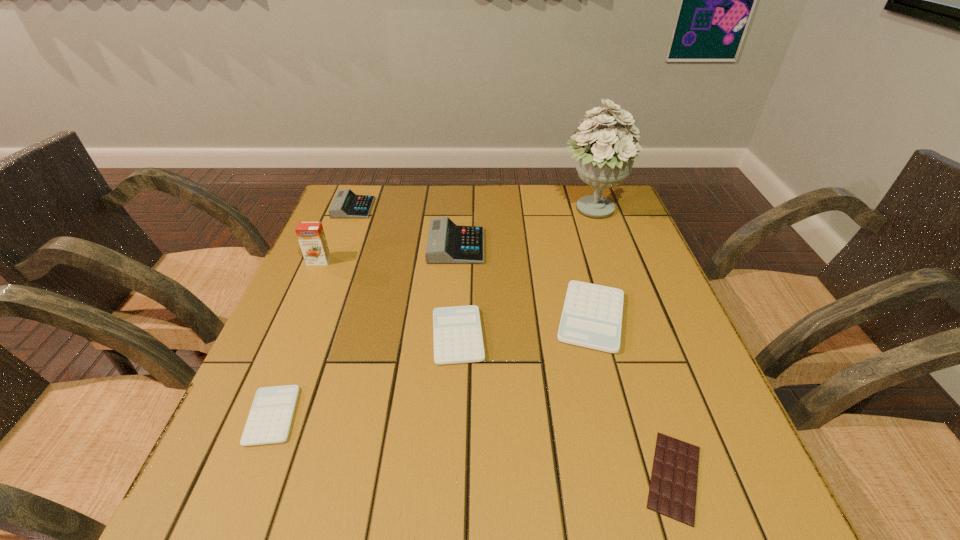
Find the location of a particular element. This screenshot has height=540, width=960. green bouquet is located at coordinates (604, 159).

I want to click on bouquet, so [x=604, y=159].

This screenshot has width=960, height=540. Identify the location of orange orange juice. (311, 236).

Where is `orange juice`? orange juice is located at coordinates (311, 236).

Identify the location of the tallest calculator. (448, 243).

Locate an element on the screen. Image resolution: width=960 pixels, height=540 pixels. the third tallest object is located at coordinates (448, 243).

Where is `the second tallest calculator`? the second tallest calculator is located at coordinates (346, 204).

At what (x,y) coordinates should I click in order to perform the action: click on the left gray calculator. Please return your answer as a coordinate pair (x, y). Looking at the image, I should click on 346,204.

Locate an element on the screen. Image resolution: width=960 pixels, height=540 pixels. the rightmost calculator is located at coordinates (592, 314).

The height and width of the screenshot is (540, 960). In order to click on the third shortest calculator in this screenshot , I will do `click(592, 314)`.